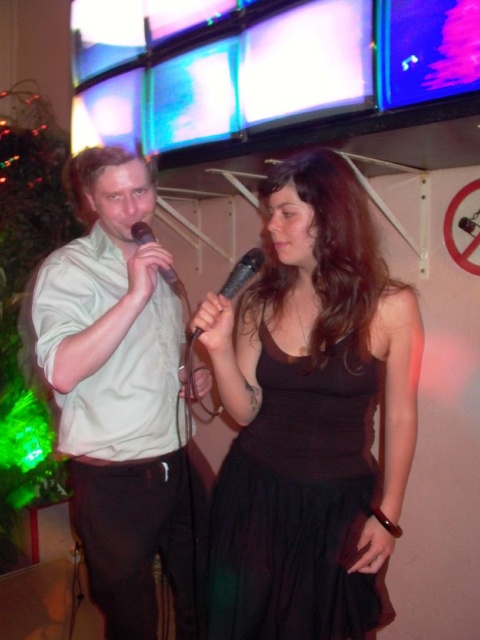
You are a photographer trying to capture a photo of the two people in the karaoke scene. You notice two points in the image labeled as point 1 at coordinates point (132,344) and point 2 at coordinates point (167,278). Which point should you focus on to ensure the person closer to the camera is in sharp focus?

Point 1 at coordinates point (132,344) should be focused on because it is further to the camera than point 2 at coordinates point (167,278), meaning the person closer to the camera is at point 1.

Looking at this image, you are a photographer setting up a shot of the karaoke scene. The matte white shirt at left and the black matte microphone at center are in your frame. Based on their sizes, which object should you focus on to ensure it fills the frame more?

The matte white shirt at left is taller than the black matte microphone at center, so focusing on the matte white shirt at left will fill the frame more due to its greater height.

Consider the image. You are standing in front of the karaoke screens and notice two people holding microphones. The person on the left is wearing a light colored long sleeved shirt rolled up to his elbows and dark pants. The person on the right is wearing a sleeveless black dress. There is a point at coordinates (120, 397) in the image. Which object does this point correspond to?

The point at (120, 397) corresponds to the matte white shirt at left.